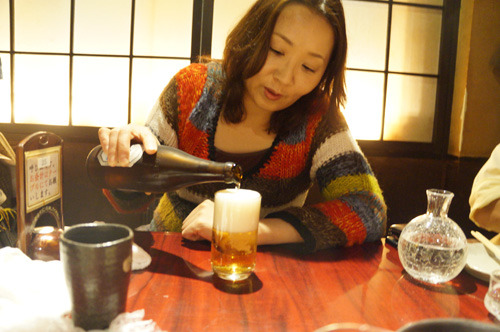
Locate an element on the screen. bottle is located at coordinates (208, 170).